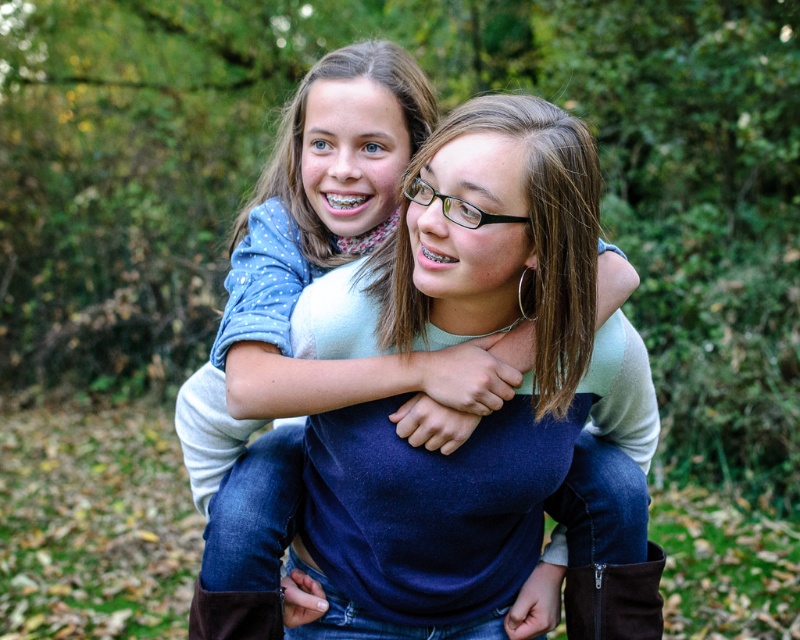
Is matte blue sweater at center to the left of brown suede boot at lower right from the viewer's perspective?

Correct, you'll find matte blue sweater at center to the left of brown suede boot at lower right.

Does point (462, 385) come in front of point (582, 572)?

Yes, point (462, 385) is in front of point (582, 572).

The width and height of the screenshot is (800, 640). What are the coordinates of `matte blue sweater at center` in the screenshot? It's located at (296, 300).